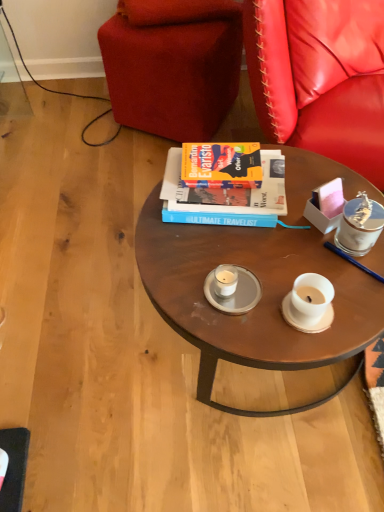
Find the location of `vacant region to the left of clear glass saucer at center`. vacant region to the left of clear glass saucer at center is located at coordinates (179, 280).